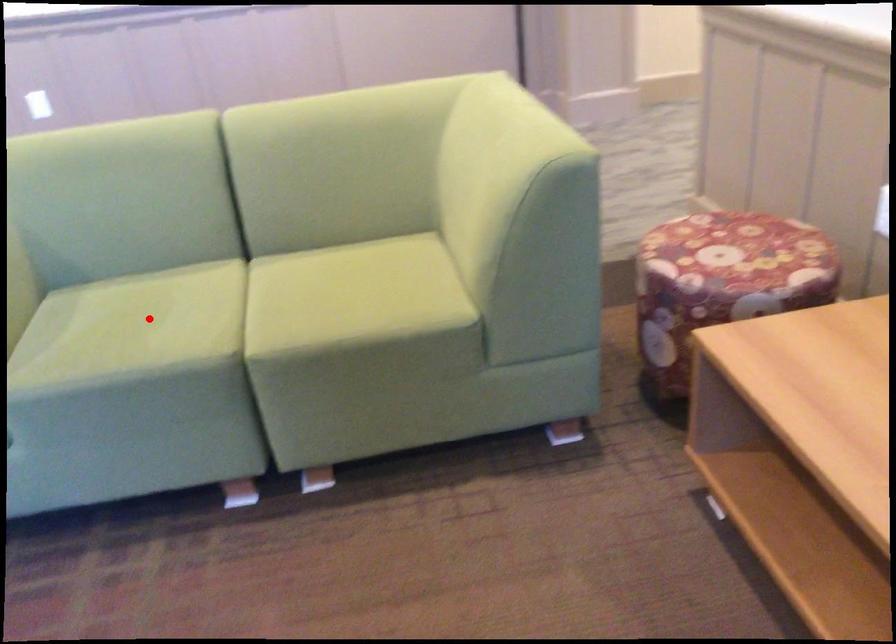
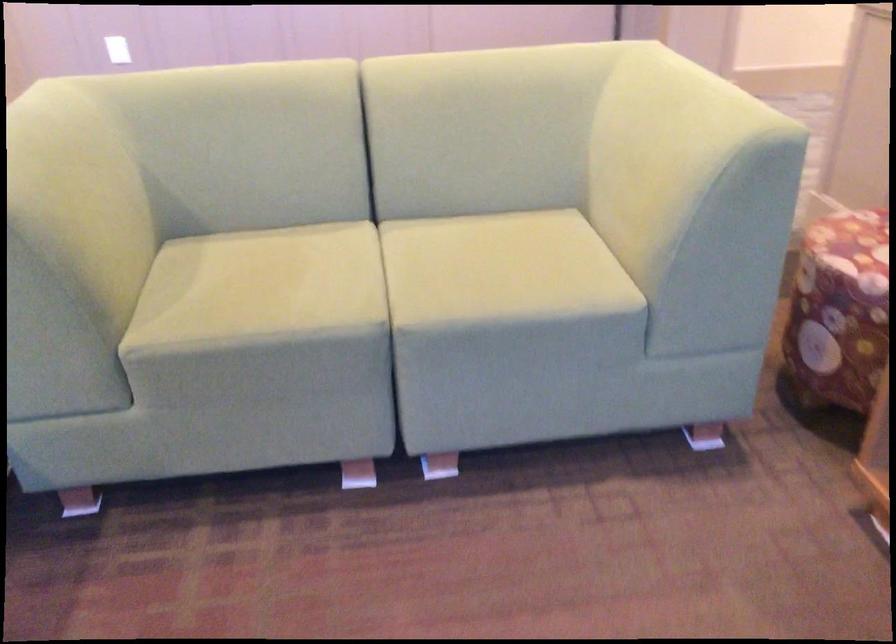
Where in the second image is the point corresponding to the highlighted location from the first image?

(280, 277)